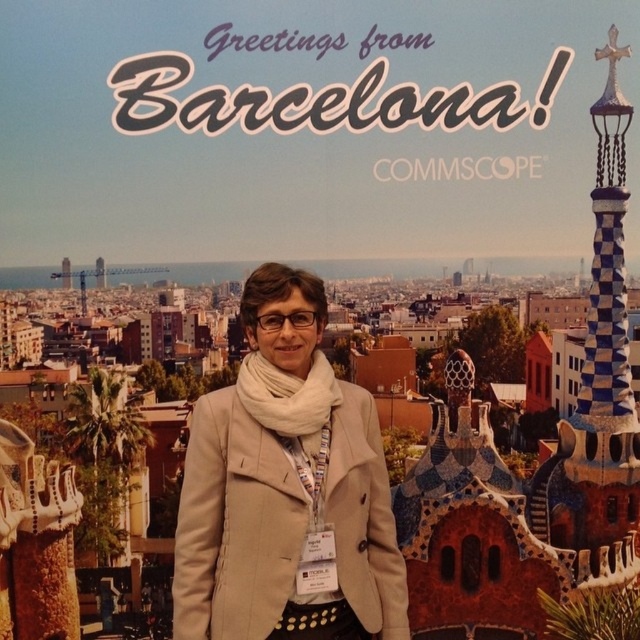
You are a photographer planning to take a photo of the beige wool coat at center and the blue and white checkered tower at right in the background. Which object is taller?

The beige wool coat at center is shorter than the blue and white checkered tower at right, so the tower is taller.

You are a photographer planning to capture a photo of the beige wool coat at center and the blue and white checkered tower at right. Based on their positions, which object should you focus on first if you want to ensure both are in the frame without moving the camera?

The beige wool coat at center is positioned on the left side of the blue and white checkered tower at right, so you should focus on the beige wool coat at center first to ensure both are in the frame without moving the camera.

You are a photographer planning to take a photo of the beige wool coat at center and the blue and white checkered tower at right in the background. Considering their sizes, which object should you focus on first to ensure both are in frame without cropping?

The beige wool coat at center has a lesser width compared to the blue and white checkered tower at right, so you should focus on framing the blue and white checkered tower at right first to accommodate its larger size, then adjust to include the smaller beige wool coat at center.